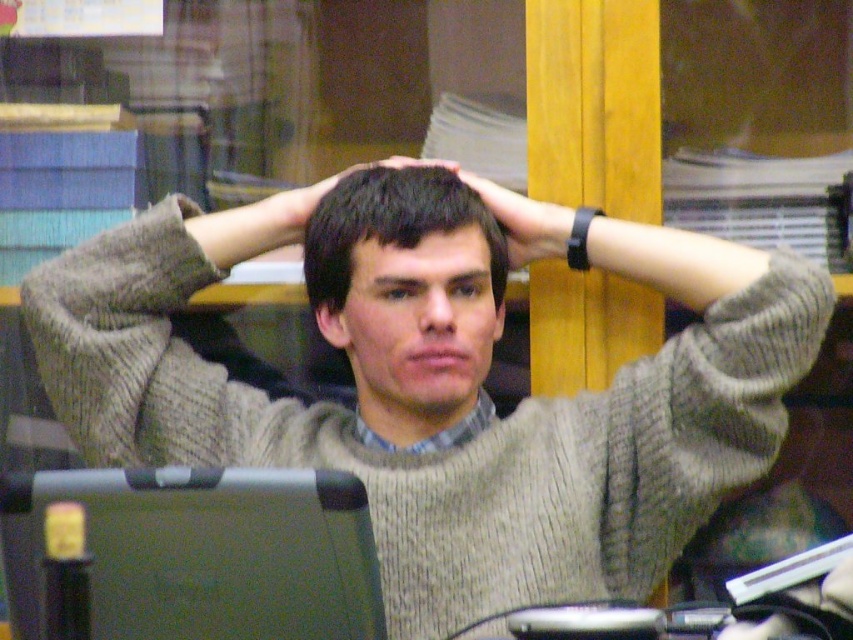
You are a photographer adjusting the lighting for a portrait. You notice the dark brown hair at center and the black matte wristband at center. Which object is positioned lower on the person?

The dark brown hair at center is positioned lower than the black matte wristband at center.

You are an interior designer analyzing the placement of objects in the image. The gray knitted sweater at center is at point 0.600, 0.517. If the coordinate system starts at the bottom left corner of the image with x increasing to the right and y increasing upwards, where would you place a decorative pillow to complement the sweater without overlapping it?

The gray knitted sweater at center is located at coordinates [440,384]. To place a decorative pillow without overlapping, position it either to the left of the sweater by choosing an x value less than 0.600 or below it by selecting a y value less than 0.517.